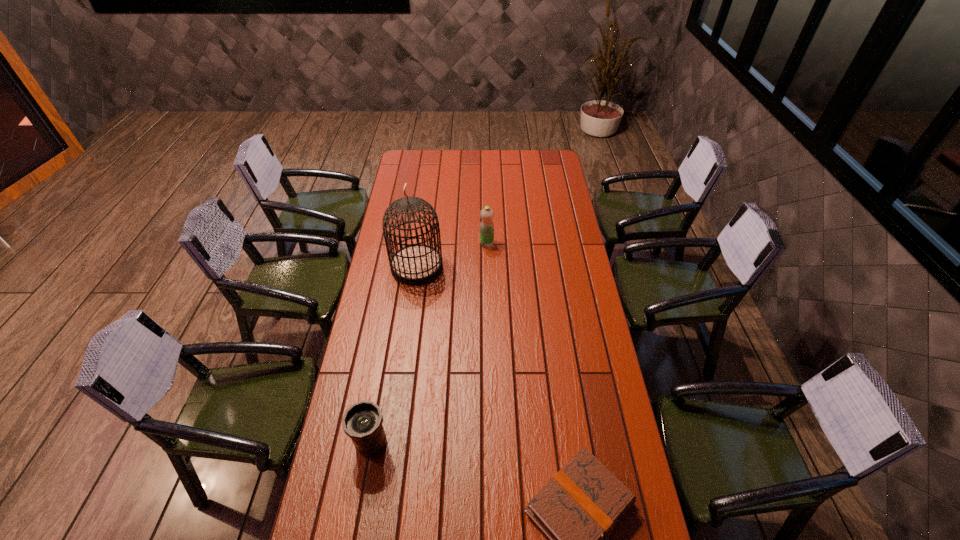
This screenshot has height=540, width=960. I want to click on birdcage, so click(x=415, y=264).

Identify the location of the tallest object. This screenshot has width=960, height=540. (x=415, y=264).

The image size is (960, 540). I want to click on the second tallest object, so click(x=486, y=230).

Locate an element on the screen. This screenshot has height=540, width=960. water bottle is located at coordinates (486, 230).

Locate an element on the screen. The width and height of the screenshot is (960, 540). telephoto lens is located at coordinates (x=362, y=421).

At what (x,y) coordinates should I click in order to perform the action: click on vacant space situated on the right of the birdcage. Please return your answer as a coordinate pair (x, y). Image resolution: width=960 pixels, height=540 pixels. Looking at the image, I should click on (469, 267).

Image resolution: width=960 pixels, height=540 pixels. I want to click on free region located 0.170m on the front of the farthest object, so click(487, 275).

The image size is (960, 540). I want to click on vacant area situated on the back of the telephoto lens, so click(x=380, y=393).

Where is `birdcage present at the left edge`? birdcage present at the left edge is located at coordinates (415, 264).

At what (x,y) coordinates should I click in order to perform the action: click on telephoto lens situated at the left edge. Please return your answer as a coordinate pair (x, y). This screenshot has height=540, width=960. Looking at the image, I should click on (362, 421).